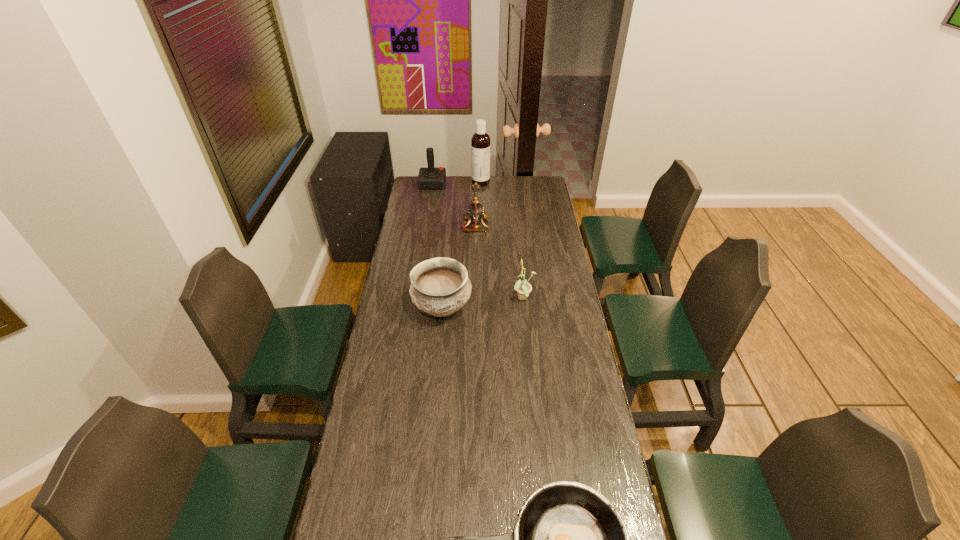
Identify which object is located as the third nearest to the pottery. Please provide its 2D coordinates. Your answer should be formatted as a tuple, i.e. [(x, y)], where the tuple contains the x and y coordinates of a point satisfying the conditions above.

[(569, 539)]

Where is `vacant space that satisfies the following two spatial constraints: 1. on the base of the pottery; 2. on the left side of the joystick`? Image resolution: width=960 pixels, height=540 pixels. vacant space that satisfies the following two spatial constraints: 1. on the base of the pottery; 2. on the left side of the joystick is located at coordinates (413, 309).